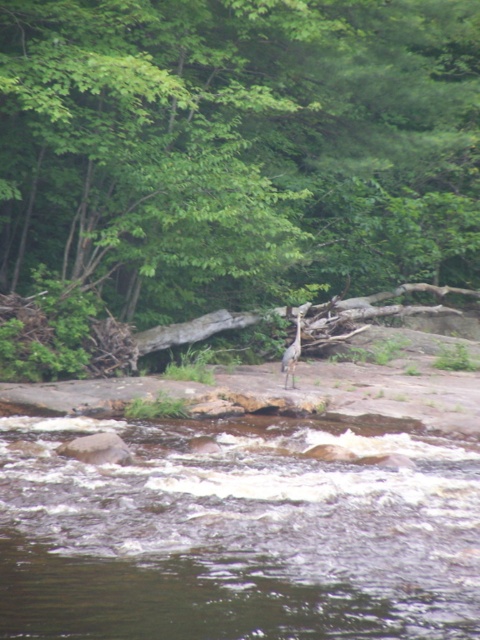
Question: Which of the following is the closest to the observer?

Choices:
 (A) green leafy tree at center
 (B) brown smooth water at lower center
 (C) gray matte bird at center

Answer: (B)

Question: Which of the following is the farthest from the observer?

Choices:
 (A) (299, 332)
 (B) (40, 452)
 (C) (324, 19)

Answer: (C)

Question: Is brown smooth water at lower center in front of gray matte bird at center?

Choices:
 (A) no
 (B) yes

Answer: (B)

Question: Which point appears farthest from the camera in this image?

Choices:
 (A) (296, 340)
 (B) (143, 467)

Answer: (A)

Question: Can you confirm if green leafy tree at center is bigger than gray matte bird at center?

Choices:
 (A) yes
 (B) no

Answer: (A)

Question: Does green leafy tree at center appear over brown smooth water at lower center?

Choices:
 (A) no
 (B) yes

Answer: (B)